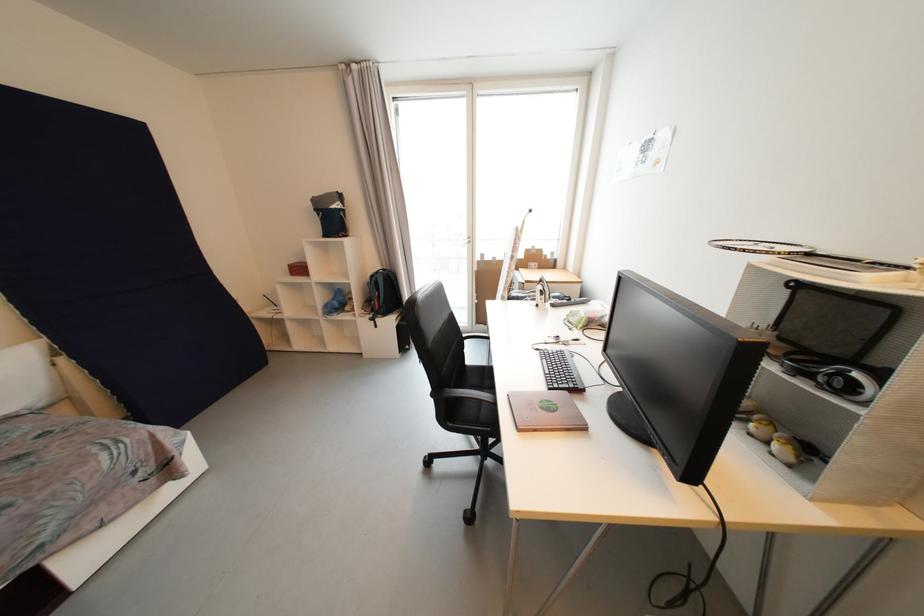
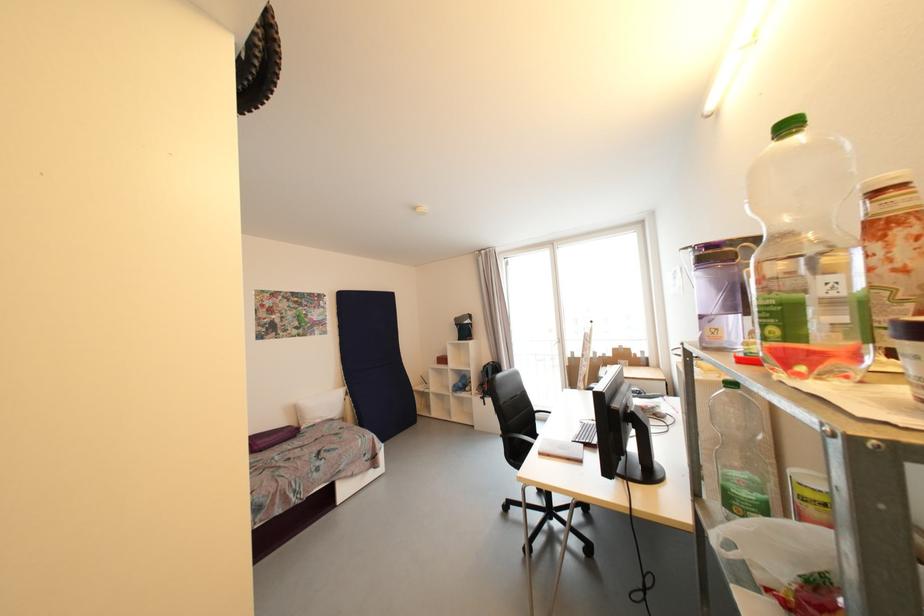
In the second image, find the point that corresponds to [378,278] in the first image.

(490, 368)